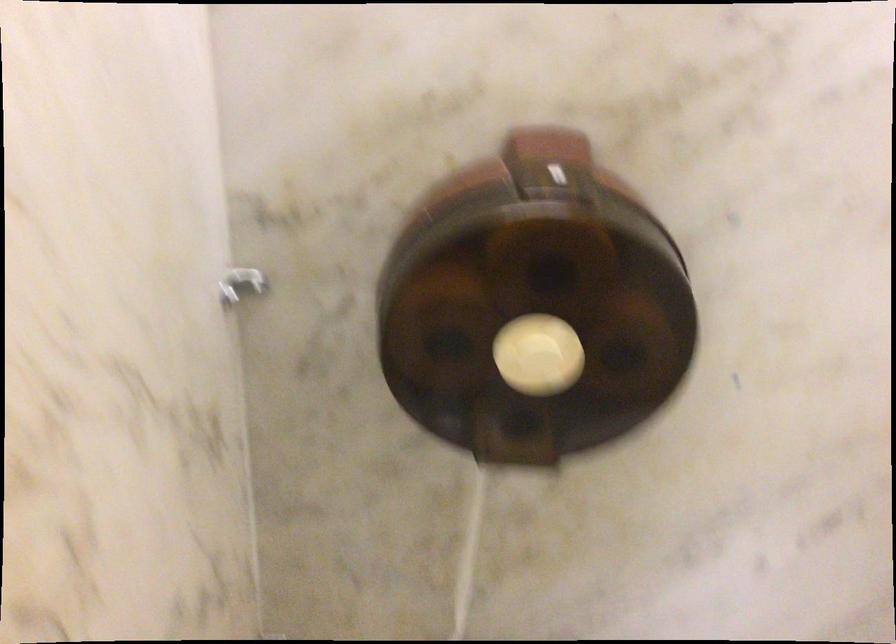
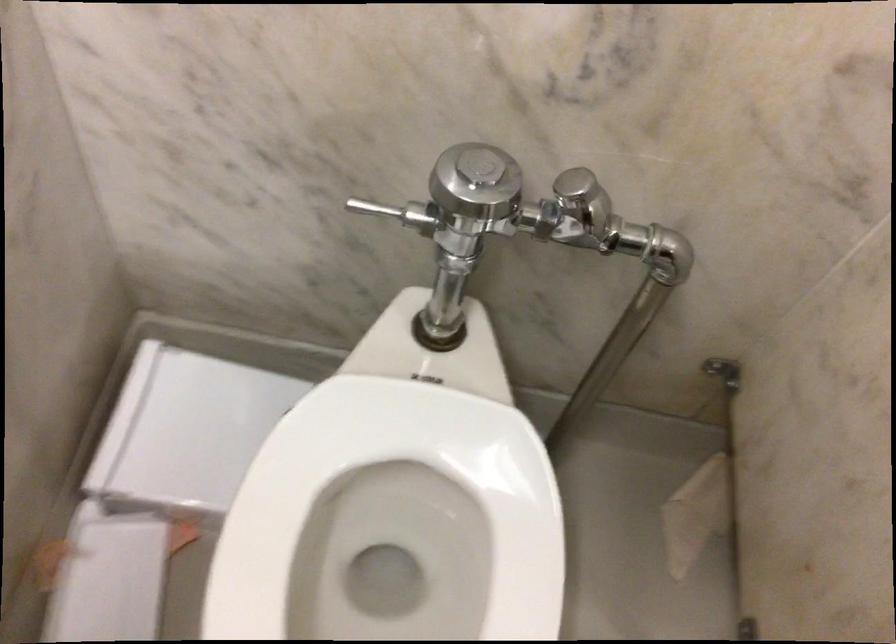
Based on the continuous images, in which direction is the camera rotating?

The camera rotated toward right-down.